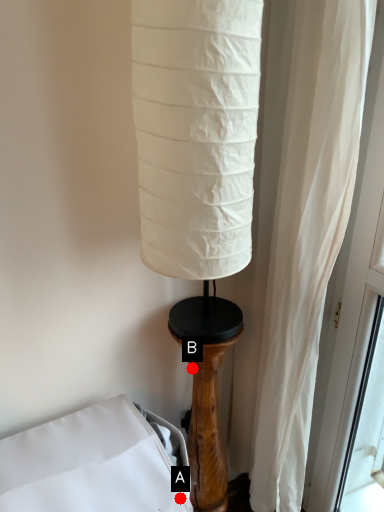
Question: Two points are circled on the image, labeled by A and B beside each circle. Which point is closer to the camera?

Choices:
 (A) A is closer
 (B) B is closer

Answer: (A)